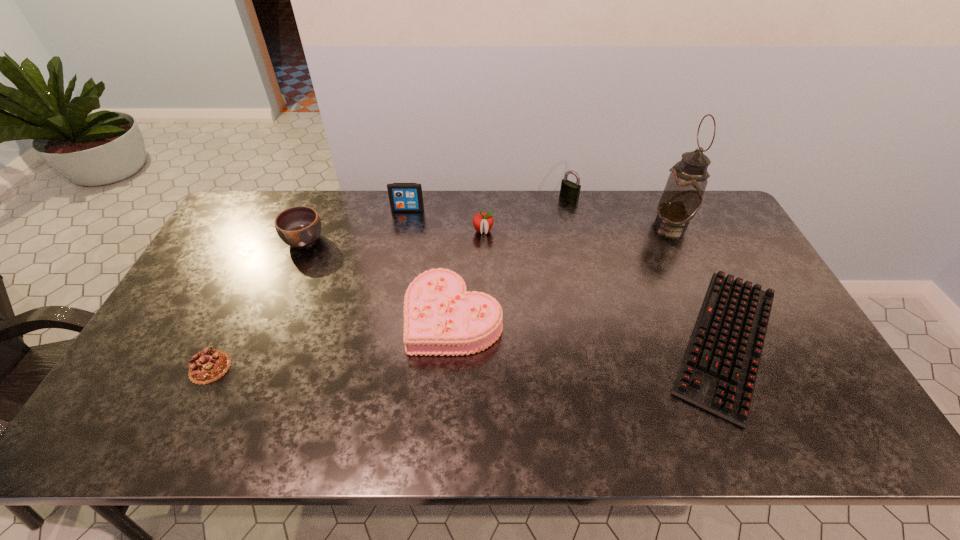
Where is `free region located on the front of the third object from right to left`? free region located on the front of the third object from right to left is located at coordinates (576, 228).

Locate an element on the screen. vacant space located on the front screen of the iPod is located at coordinates (403, 234).

Where is `free spot located on the front of the bowl`? free spot located on the front of the bowl is located at coordinates (256, 355).

The width and height of the screenshot is (960, 540). I want to click on free spot located 0.170m on the front of the apple, so click(484, 274).

Find the location of `vacant space located on the left of the cake`. vacant space located on the left of the cake is located at coordinates (273, 316).

Locate an element on the screen. This screenshot has height=540, width=960. blank space located 0.130m on the front of the second shortest object is located at coordinates (177, 436).

Identify the location of vacant space located on the back of the computer keyboard. (664, 210).

Identify the location of oil lamp located at the far edge. The image size is (960, 540). (683, 194).

I want to click on padlock that is at the far edge, so click(x=569, y=190).

Locate an element on the screen. The image size is (960, 540). iPod situated at the far edge is located at coordinates (404, 197).